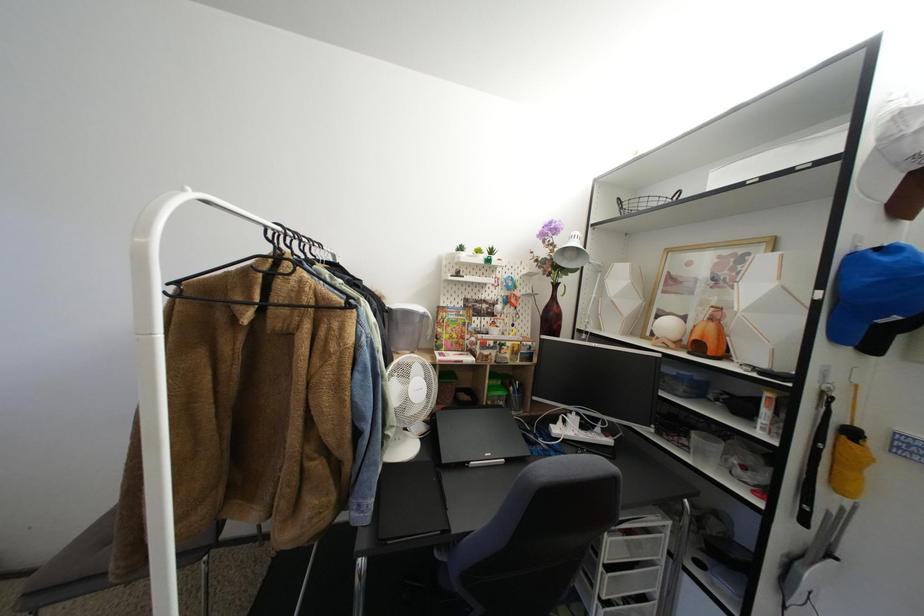
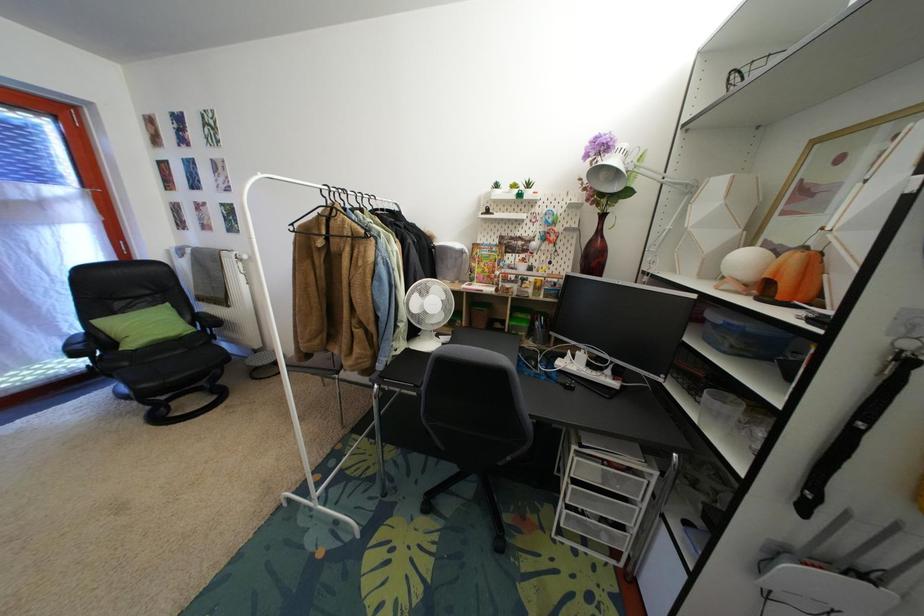
Question: The camera is either moving clockwise (left) or counter-clockwise (right) around the object. The first image is from the beginning of the video and the second image is from the end. Is the camera moving left or right when shooting the video?

Choices:
 (A) Left
 (B) Right

Answer: (B)